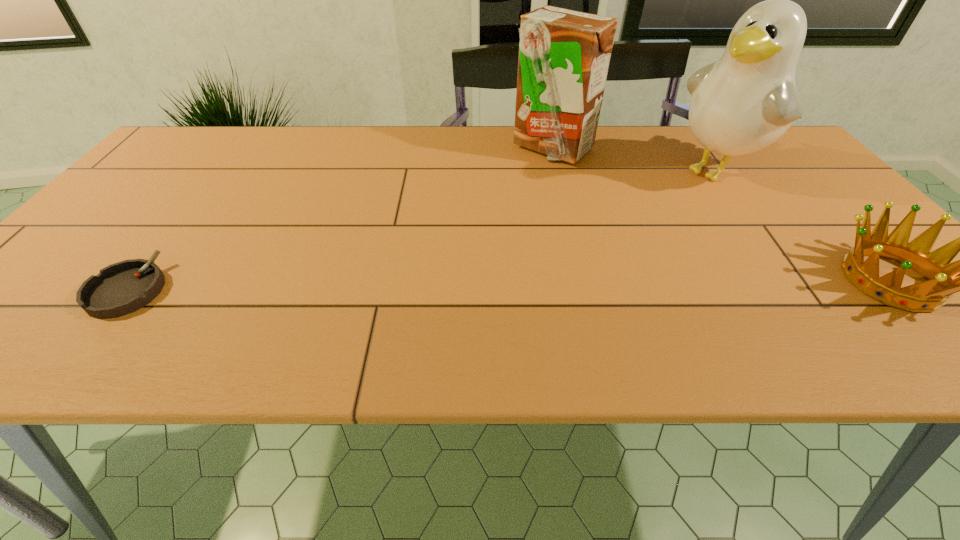
Where is `vacant space located 0.190m on the beak of the tallest object`? vacant space located 0.190m on the beak of the tallest object is located at coordinates (639, 217).

Find the location of `vacant space located on the beak of the tallest object`. vacant space located on the beak of the tallest object is located at coordinates (581, 251).

The width and height of the screenshot is (960, 540). In order to click on carton that is at the far edge in this screenshot , I will do `click(564, 55)`.

Where is `gull located in the far edge section of the desktop`? Image resolution: width=960 pixels, height=540 pixels. gull located in the far edge section of the desktop is located at coordinates (742, 103).

The image size is (960, 540). Identify the location of object present at the near edge. (124, 287).

Image resolution: width=960 pixels, height=540 pixels. I want to click on object that is at the left edge, so click(x=124, y=287).

The height and width of the screenshot is (540, 960). Identify the location of object at the right edge. (742, 103).

Find the location of a particular element. object located in the near left corner section of the desktop is located at coordinates (124, 287).

Locate an element on the screen. The height and width of the screenshot is (540, 960). object that is at the far right corner is located at coordinates (742, 103).

Find the location of a particular element. free spot at the far edge of the desktop is located at coordinates (271, 132).